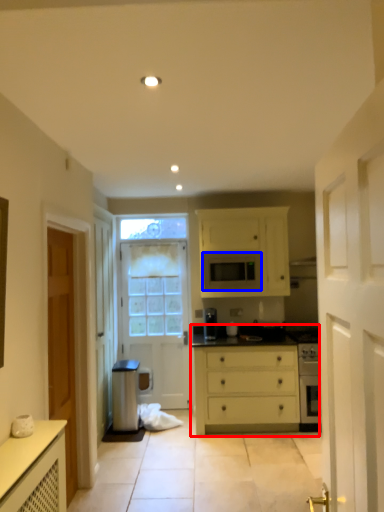
Question: Which of the following is the farthest to the observer, chest of drawers (highlighted by a red box) or microwave oven (highlighted by a blue box)?

Choices:
 (A) chest of drawers
 (B) microwave oven

Answer: (B)